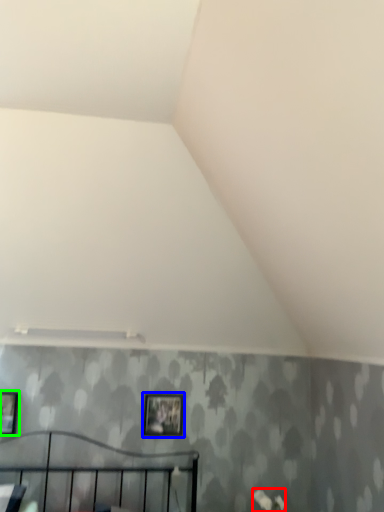
Question: Considering the real-world distances, which object is closest to flower (highlighted by a red box)? picture frame (highlighted by a blue box) or picture frame (highlighted by a green box).

Choices:
 (A) picture frame
 (B) picture frame

Answer: (A)